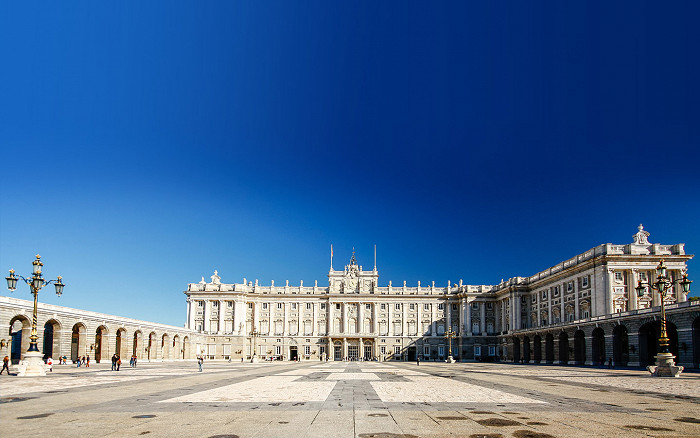
Locate an element on the screen. This screenshot has width=700, height=438. ornate lights is located at coordinates (34, 306), (663, 305).